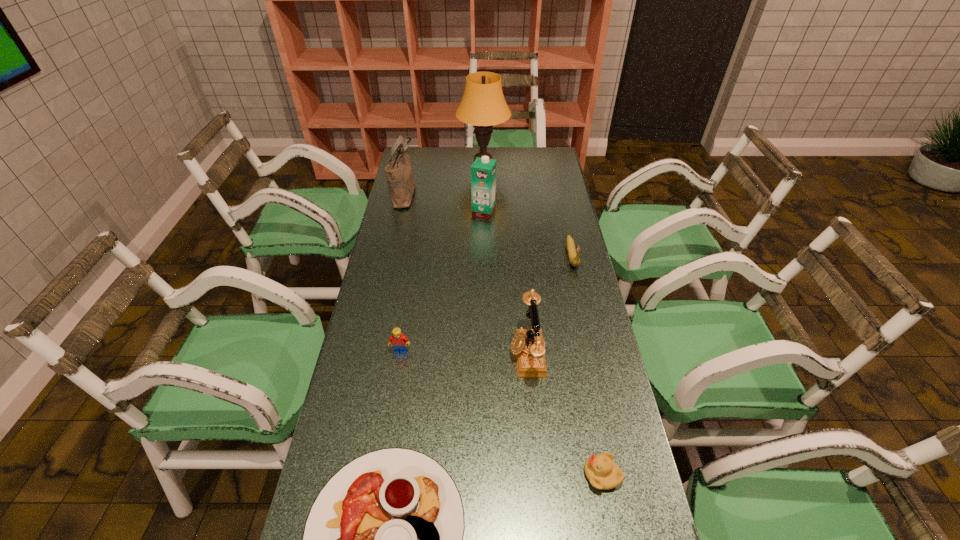
The width and height of the screenshot is (960, 540). I want to click on free space located 0.080m on the right of the carton, so click(516, 212).

Locate an element on the screen. The height and width of the screenshot is (540, 960). free space located on the dial of the fifth shortest object is located at coordinates (380, 353).

Where is `vacant space located 0.330m on the dial of the fifth shortest object`? The image size is (960, 540). vacant space located 0.330m on the dial of the fifth shortest object is located at coordinates (397, 353).

You are a GUI agent. You are given a task and a screenshot of the screen. Output one action in this format:
    pyautogui.click(x=<x>, y=<y>)
    Task: Click on the blank space located 0.230m on the dial of the fifth shortest object
    The image size is (960, 540).
    Given the screenshot: What is the action you would take?
    coord(431,353)

Identify the location of free space located at the stem of the banana. This screenshot has width=960, height=540. (591, 341).

Image resolution: width=960 pixels, height=540 pixels. I want to click on free space located 0.100m on the face of the Lego, so click(x=396, y=384).

Find the location of `vacant space located 0.090m on the beak of the seventh tallest object`. vacant space located 0.090m on the beak of the seventh tallest object is located at coordinates (545, 475).

Locate an element on the screen. free space located on the beak of the seventh tallest object is located at coordinates (435, 475).

Where is `vacant region located on the beak of the seventh tallest object`? vacant region located on the beak of the seventh tallest object is located at coordinates (435, 475).

This screenshot has width=960, height=540. Identify the location of object that is at the far edge. (483, 105).